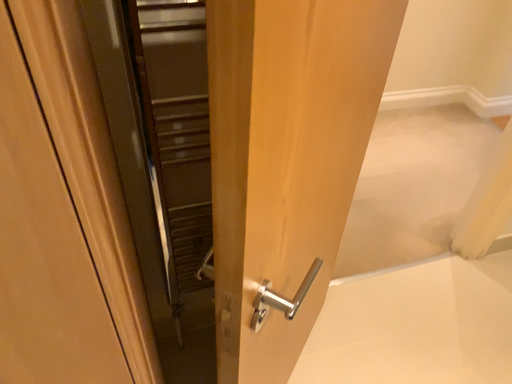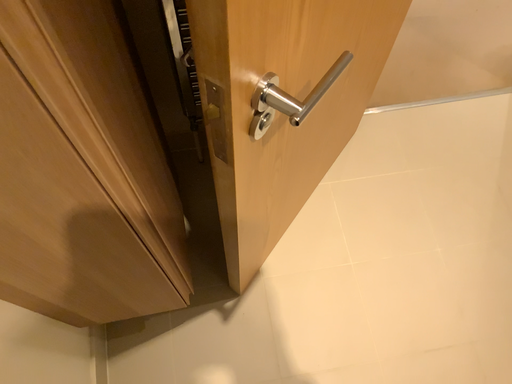
Question: Which way did the camera rotate in the video?

Choices:
 (A) rotated left
 (B) rotated right

Answer: (A)